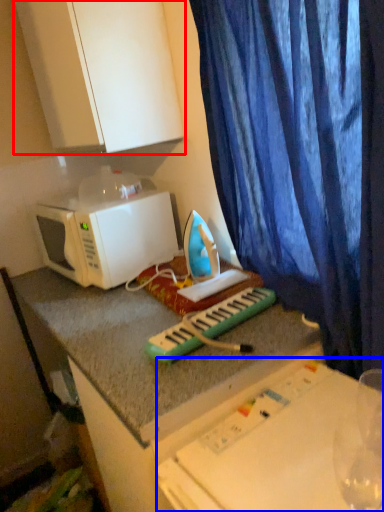
Question: Which object appears closest to the camera in this image, cabinetry (highlighted by a red box) or table (highlighted by a blue box)?

Choices:
 (A) cabinetry
 (B) table

Answer: (B)